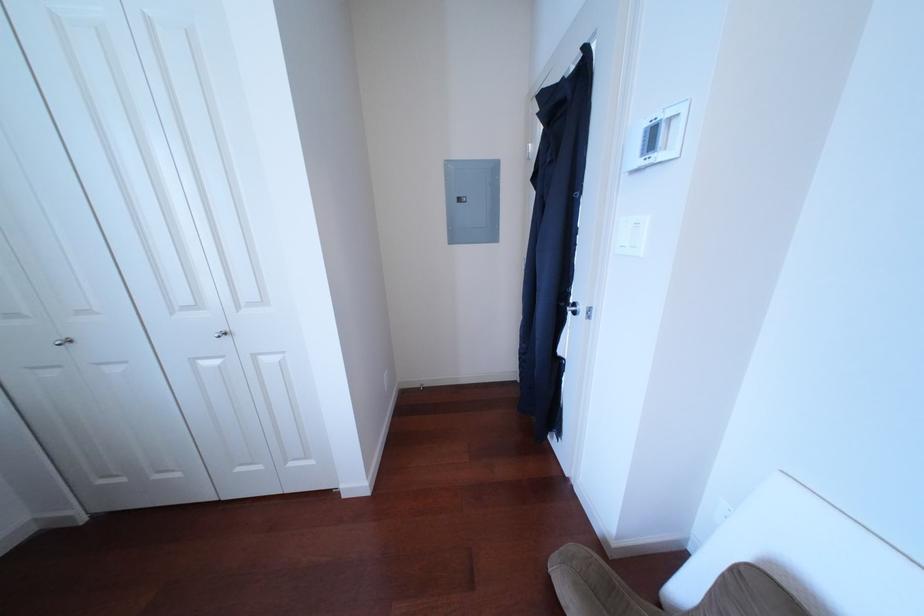
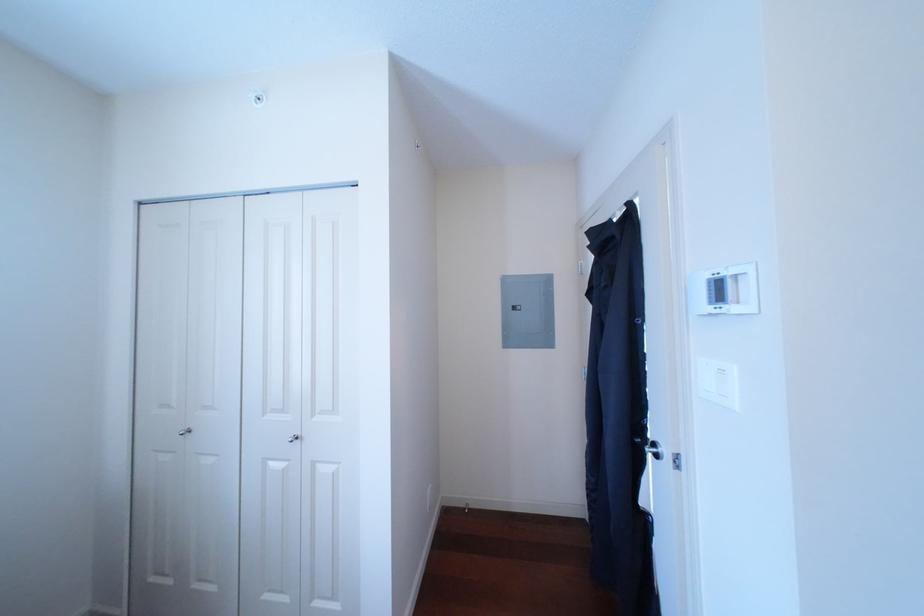
Question: The images are taken continuously from a first-person perspective. In which direction are you moving?

Choices:
 (A) Left
 (B) Right
 (C) Forward
 (D) Backward

Answer: (D)